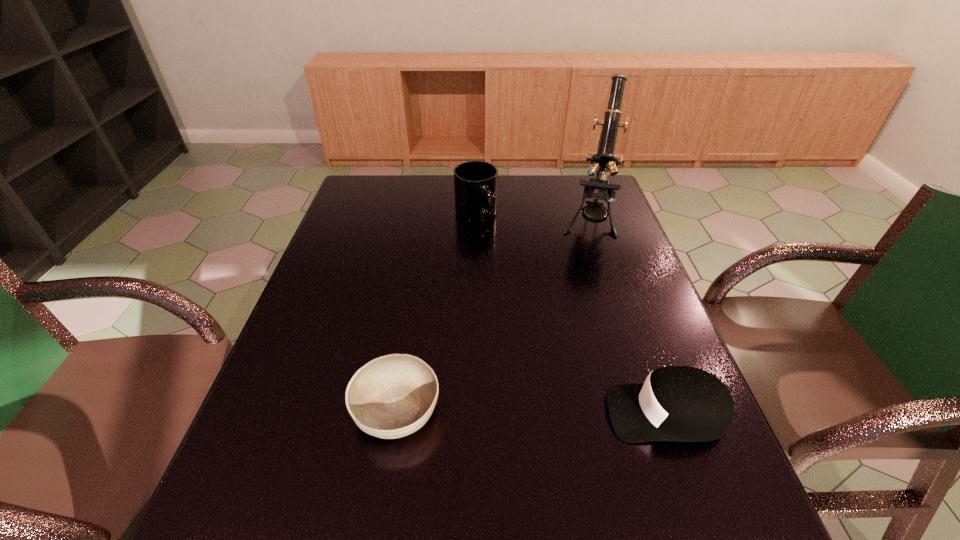
I want to click on vacant area in the image that satisfies the following two spatial constraints: 1. on the front side of the tallest object; 2. on the front-facing side of the third tallest object, so click(x=651, y=413).

At what (x,y) coordinates should I click in order to perform the action: click on vacant space that satisfies the following two spatial constraints: 1. on the front side of the third tallest object; 2. on the front-facing side of the mug. Please return your answer as a coordinate pair (x, y). The height and width of the screenshot is (540, 960). Looking at the image, I should click on (474, 413).

The height and width of the screenshot is (540, 960). I want to click on vacant point that satisfies the following two spatial constraints: 1. on the back side of the third shortest object; 2. on the right side of the shortest object, so click(428, 215).

In order to click on free space that satisfies the following two spatial constraints: 1. on the front side of the tallest object; 2. on the left side of the mug in this screenshot , I will do `click(476, 222)`.